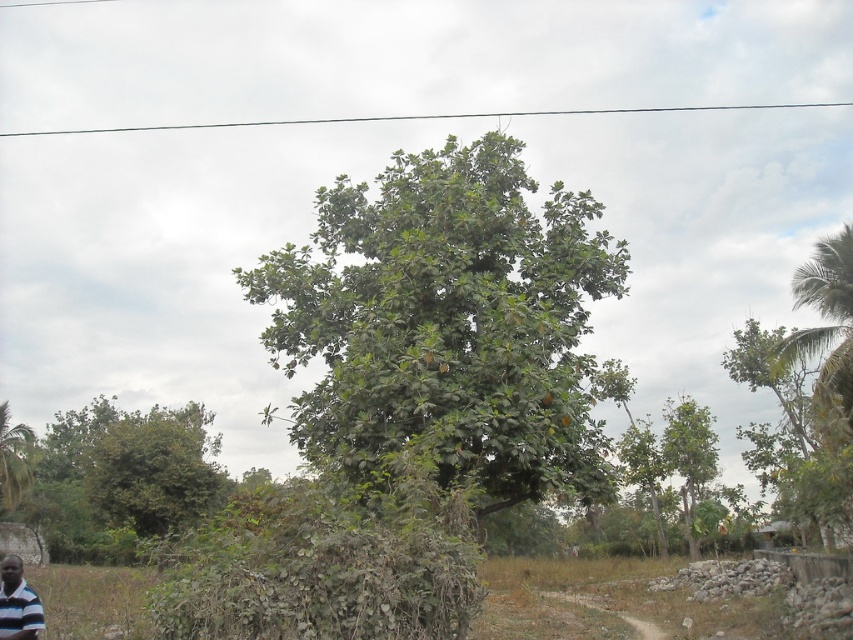
Question: Does green leafy tree at center appear on the right side of green leafy tree at right?

Choices:
 (A) yes
 (B) no

Answer: (B)

Question: Among these objects, which one is farthest from the camera?

Choices:
 (A) green leafy tree at right
 (B) striped polo shirt at lower left
 (C) green leafy tree at center

Answer: (A)

Question: Is green leafy tree at center further to camera compared to green leafy tree at lower left?

Choices:
 (A) no
 (B) yes

Answer: (A)

Question: Does green leafy tree at lower left have a greater width compared to striped polo shirt at lower left?

Choices:
 (A) yes
 (B) no

Answer: (A)

Question: Which of the following is the farthest from the observer?

Choices:
 (A) green leafy tree at center
 (B) green leafy tree at lower left
 (C) striped polo shirt at lower left
 (D) green leafy tree at right

Answer: (D)

Question: Estimate the real-world distances between objects in this image. Which object is closer to the green leafy tree at lower left?

Choices:
 (A) green leafy tree at center
 (B) green leafy tree at right

Answer: (A)